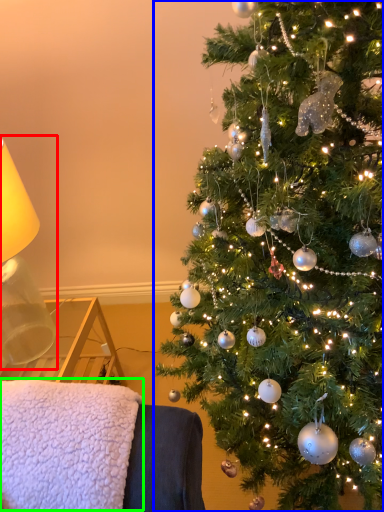
Question: Considering the real-world distances, which object is closest to table lamp (highlighted by a red box)? christmas tree (highlighted by a blue box) or blanket (highlighted by a green box).

Choices:
 (A) christmas tree
 (B) blanket

Answer: (B)